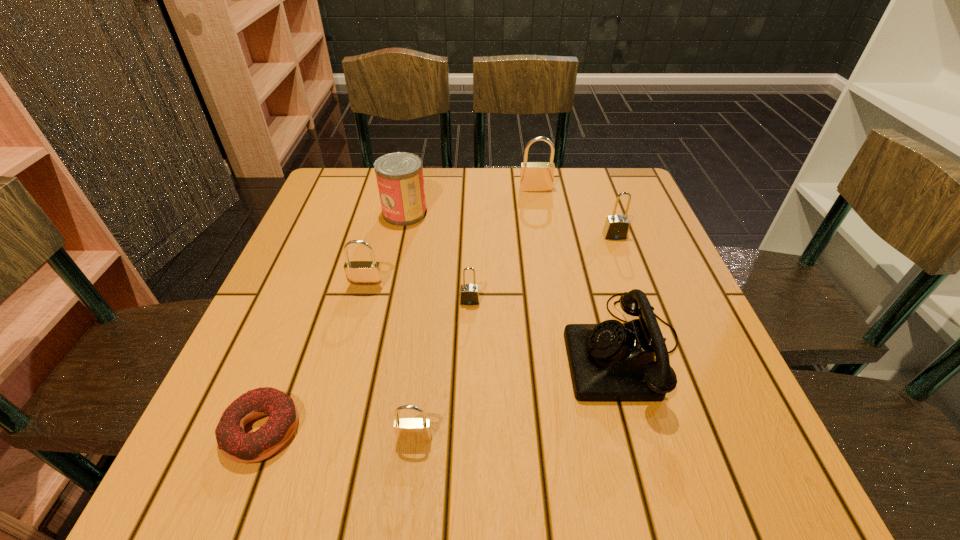
Find the location of `telephone at the right edge`. telephone at the right edge is located at coordinates (611, 361).

This screenshot has width=960, height=540. In order to click on object located at the near left corner in this screenshot , I will do `click(238, 446)`.

What are the coordinates of `free region at the far edge of the desktop` in the screenshot? It's located at (517, 179).

I want to click on free space at the near edge of the desktop, so click(x=397, y=467).

At what (x,y) coordinates should I click in order to perform the action: click on vacant region at the right edge of the desktop. Please return your answer as a coordinate pair (x, y). The width and height of the screenshot is (960, 540). Looking at the image, I should click on (685, 355).

You are a GUI agent. You are given a task and a screenshot of the screen. Output one action in this format:
    pyautogui.click(x=<x>, y=<y>)
    Task: Click on the blank space at the far left corner
    The image size is (960, 540).
    Given the screenshot: What is the action you would take?
    pyautogui.click(x=336, y=188)

Find the location of a particular element. Image resolution: width=960 pixels, height=540 pixels. vacant region between the third padlock from left to right and the smallest brass padlock is located at coordinates (442, 369).

Identify the location of vacant space in between the chocolate doughnut and the second padlock from left to right. This screenshot has height=540, width=960. (338, 434).

The width and height of the screenshot is (960, 540). I want to click on blank region between the smallest brass padlock and the right gray padlock, so click(515, 337).

The width and height of the screenshot is (960, 540). What are the coordinates of `free space between the third padlock from left to right and the fourth nearest padlock` in the screenshot? It's located at [x=542, y=268].